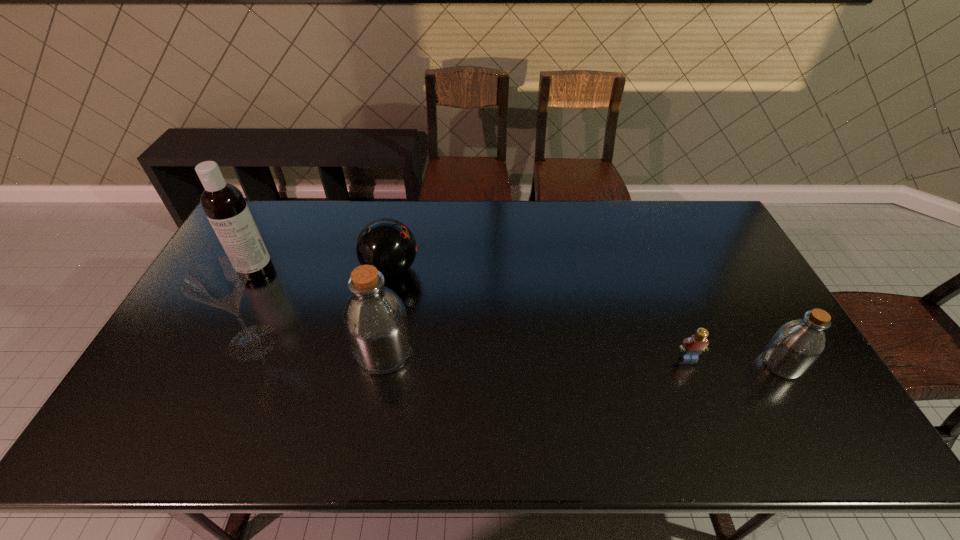
You are a GUI agent. You are given a task and a screenshot of the screen. Output one action in this format:
    pyautogui.click(x=<x>, y=<y>)
    Task: Click on the vacant area between the flute glass and the shorter bottle
    
    Given the screenshot: What is the action you would take?
    pyautogui.click(x=517, y=353)

The width and height of the screenshot is (960, 540). What are the coordinates of `free spot between the left bottle and the dishwasher detergent` in the screenshot? It's located at (320, 311).

You are a GUI agent. You are given a task and a screenshot of the screen. Output one action in this format:
    pyautogui.click(x=<x>, y=<y>)
    Task: Click on the free space between the tallest object and the second object from right to left
    The width and height of the screenshot is (960, 540).
    Given the screenshot: What is the action you would take?
    pyautogui.click(x=472, y=313)

You are a GUI agent. You are given a task and a screenshot of the screen. Output one action in this format:
    pyautogui.click(x=<x>, y=<y>)
    Task: Click on the object that stands as the fourth closest to the bowling ball
    
    Given the screenshot: What is the action you would take?
    pyautogui.click(x=692, y=347)

The image size is (960, 540). In order to click on the fourth closest object relative to the bowling ball in this screenshot , I will do `click(692, 347)`.

You are a GUI agent. You are given a task and a screenshot of the screen. Output one action in this format:
    pyautogui.click(x=<x>, y=<y>)
    Task: Click on the vacant space that satisfies the following two spatial constraints: 1. on the surface of the bowling ball near the finger holes; 2. on the back side of the left bottle
    
    Given the screenshot: What is the action you would take?
    pyautogui.click(x=373, y=352)

In order to click on vacant area in the image that satisfies the following two spatial constraints: 1. on the label side of the tallest object; 2. on the left side of the left bottle in this screenshot , I will do `click(213, 352)`.

Where is `vacant space that satisfies the following two spatial constraints: 1. on the label side of the taller bottle; 2. on the left side of the dishwasher detergent`? The width and height of the screenshot is (960, 540). vacant space that satisfies the following two spatial constraints: 1. on the label side of the taller bottle; 2. on the left side of the dishwasher detergent is located at coordinates (213, 352).

This screenshot has width=960, height=540. I want to click on vacant space that satisfies the following two spatial constraints: 1. on the surface of the left bottle near the finger holes; 2. on the right side of the bowling ball, so click(x=373, y=352).

Where is `vacant area in the image that satisfies the following two spatial constraints: 1. on the surface of the bowling ball near the finger holes; 2. on the right side of the left bottle`? vacant area in the image that satisfies the following two spatial constraints: 1. on the surface of the bowling ball near the finger holes; 2. on the right side of the left bottle is located at coordinates (373, 352).